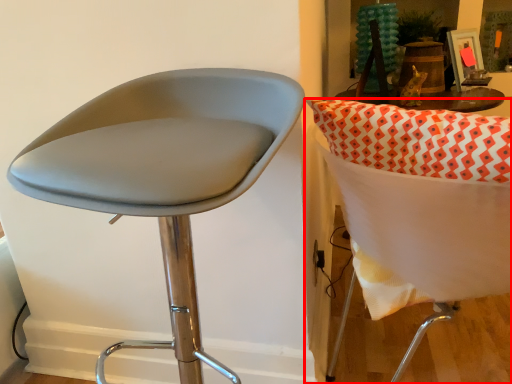
Question: From the image's perspective, where is chair (annotated by the red box) located relative to chair?

Choices:
 (A) below
 (B) above

Answer: (B)